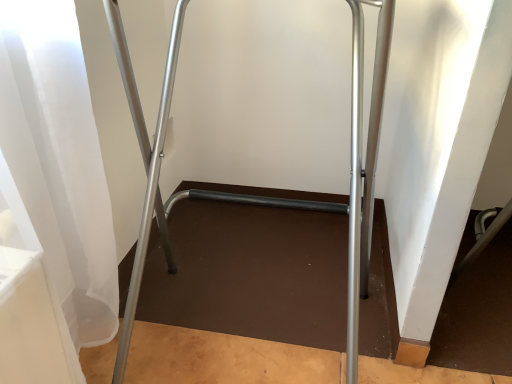
Describe the element at coordinates (351, 171) in the screenshot. I see `silver metallic crutch at center` at that location.

You are a GUI agent. You are given a task and a screenshot of the screen. Output one action in this format:
    pyautogui.click(x=<x>, y=<y>)
    Task: Click on the silver metallic crutch at center
    
    Given the screenshot: What is the action you would take?
    pyautogui.click(x=351, y=171)

Find the location of a particular element. The image size is (512, 384). silver metallic crutch at center is located at coordinates (351, 171).